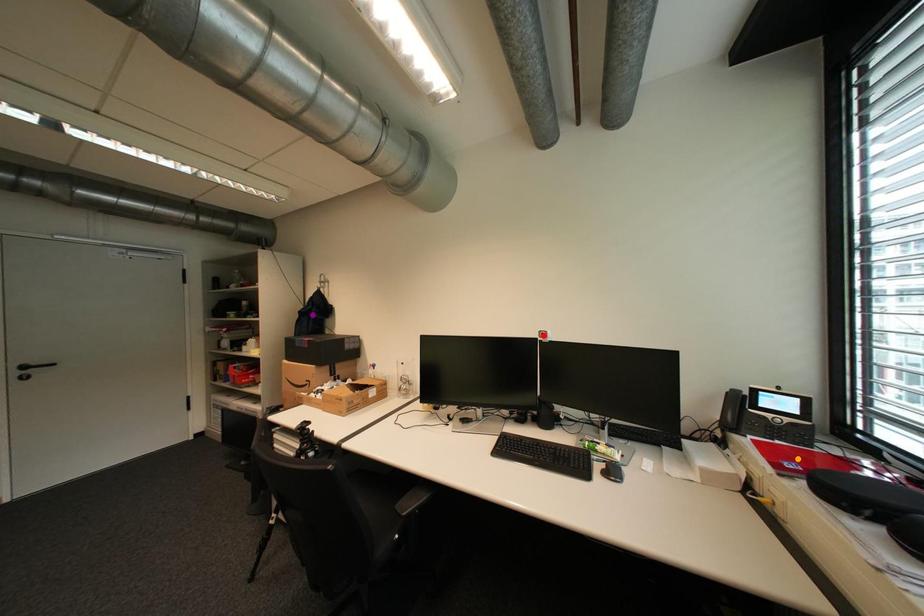
Order these from nearest to farthest:
orange point, red point, purple point

orange point, red point, purple point